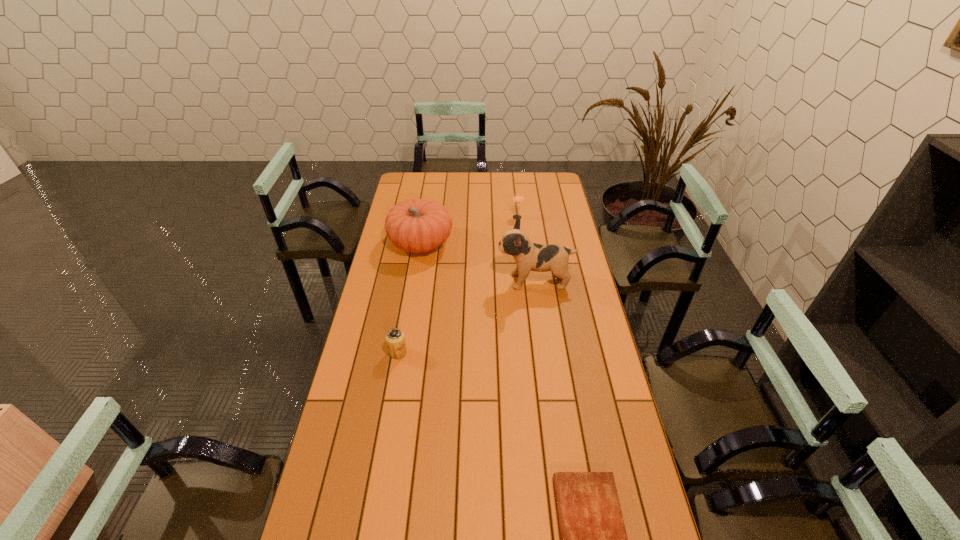
Where is `the third farthest object`? the third farthest object is located at coordinates (528, 256).

Where is `the tallest object`? the tallest object is located at coordinates (528, 256).

In order to click on the fourth nearest object in this screenshot , I will do `click(417, 226)`.

The height and width of the screenshot is (540, 960). Identify the location of the farthest object. (518, 198).

Identify the location of the fourth tallest object. The width and height of the screenshot is (960, 540). pos(395,339).

Identify the location of beer can. The image size is (960, 540). point(395,339).

I want to click on vacant space located at the face of the tallest object, so click(x=444, y=281).

Identify the location of blank space located at the face of the tallest object. The height and width of the screenshot is (540, 960). (429, 281).

Identify the location of free spot located 0.110m at the face of the tallest object. (470, 281).

Where is `vacant area situated 0.160m on the back of the pumpkin`? vacant area situated 0.160m on the back of the pumpkin is located at coordinates click(427, 207).